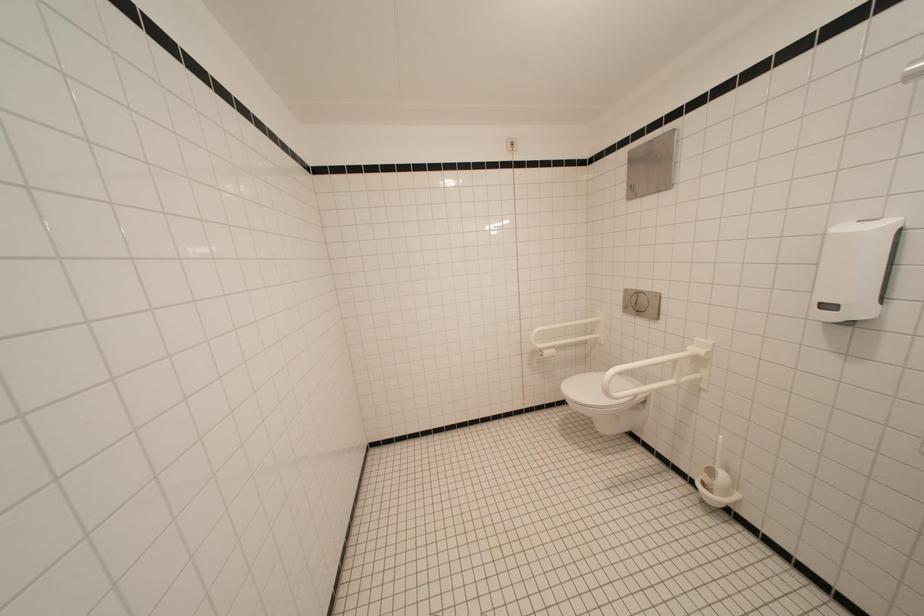
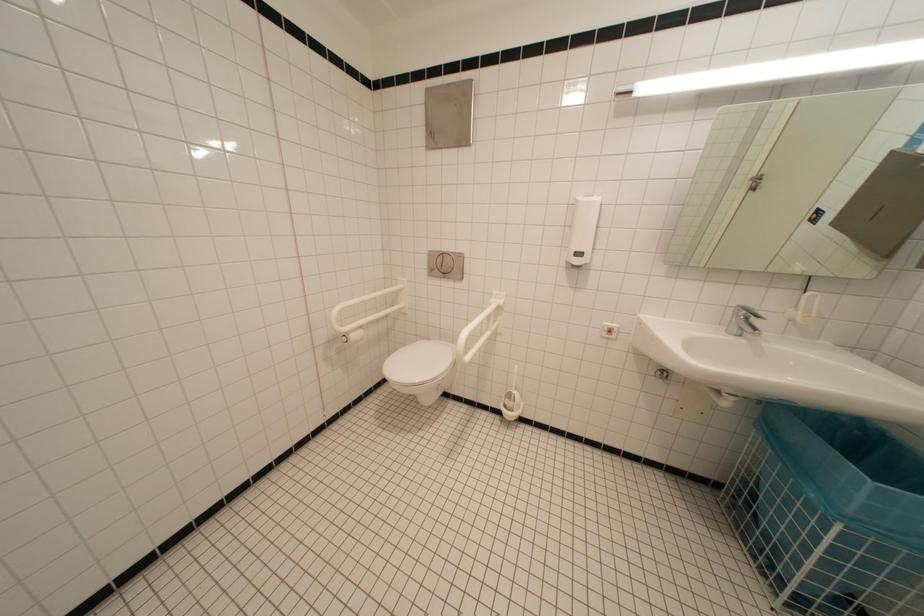
Question: The images are taken continuously from a first-person perspective. In which direction is your viewpoint rotating?

Choices:
 (A) Left
 (B) Right
 (C) Up
 (D) Down

Answer: (B)